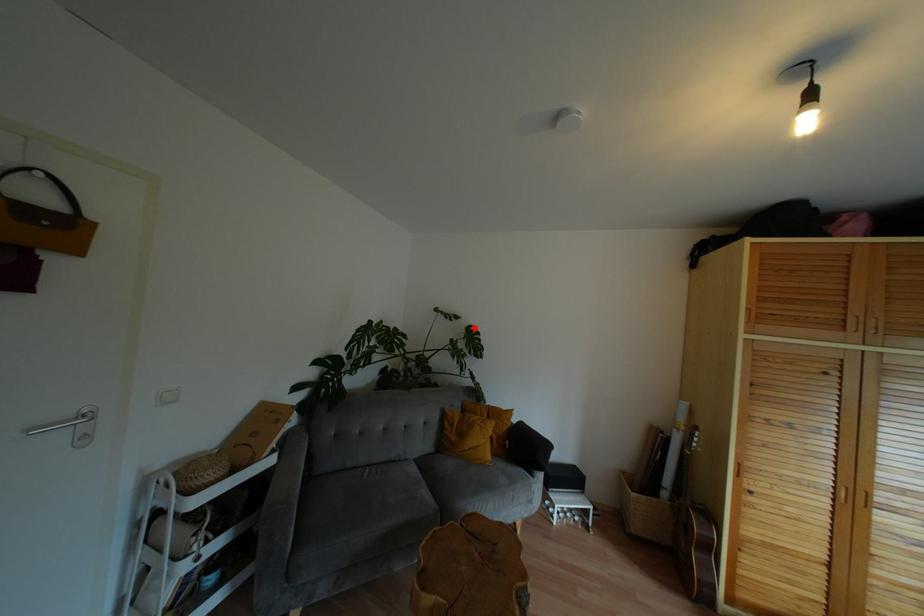
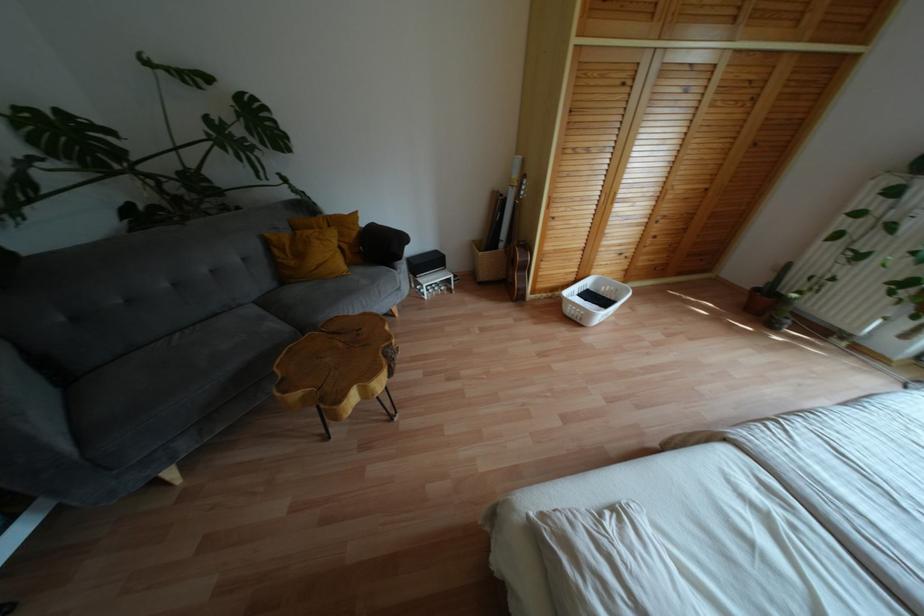
The point at the highlighted location is marked in the first image. Where is the corresponding point in the second image?

(253, 98)